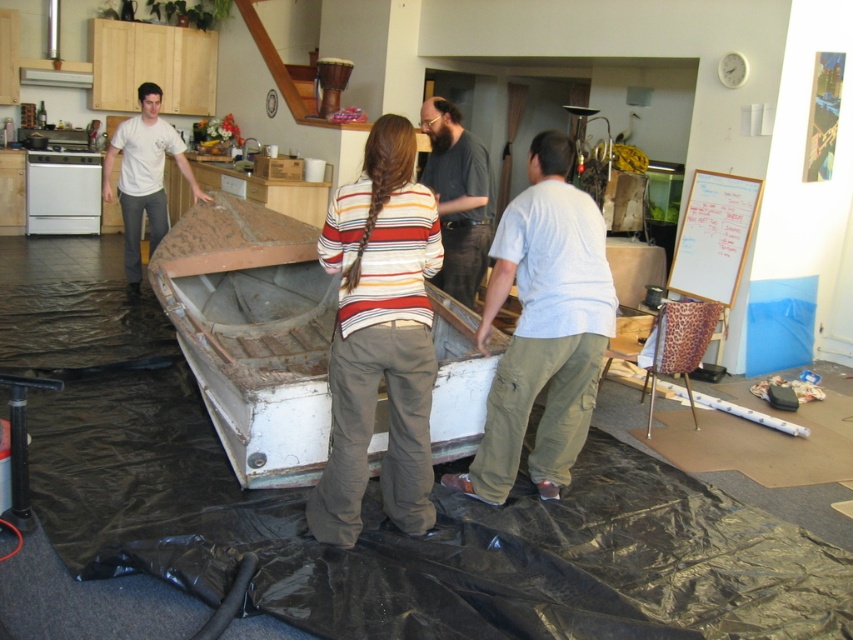
You are standing in the kitchen area and want to grab the striped sweater at center and dark brown leather jacket at center. Which one can you reach without moving your position?

The striped sweater at center is closer to the viewer than the dark brown leather jacket at center, so you can reach the striped sweater at center without moving your position.